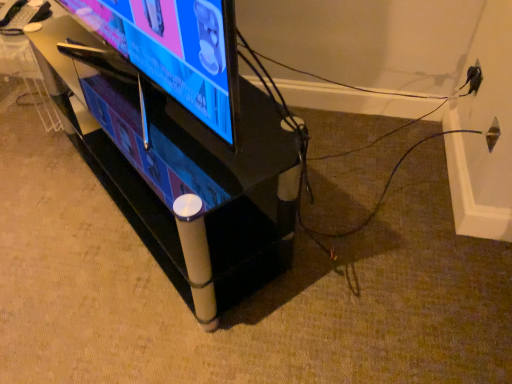
Question: Does black glossy tv stand at center have a larger size compared to matte black tv at center?

Choices:
 (A) yes
 (B) no

Answer: (A)

Question: Is black glossy tv stand at center looking in the opposite direction of matte black tv at center?

Choices:
 (A) yes
 (B) no

Answer: (B)

Question: Is black glossy tv stand at center smaller than matte black tv at center?

Choices:
 (A) no
 (B) yes

Answer: (A)

Question: From the image's perspective, would you say black glossy tv stand at center is shown under matte black tv at center?

Choices:
 (A) yes
 (B) no

Answer: (A)

Question: Considering the relative sizes of black glossy tv stand at center and matte black tv at center in the image provided, is black glossy tv stand at center shorter than matte black tv at center?

Choices:
 (A) no
 (B) yes

Answer: (A)

Question: Considering the relative sizes of black glossy tv stand at center and matte black tv at center in the image provided, is black glossy tv stand at center taller than matte black tv at center?

Choices:
 (A) yes
 (B) no

Answer: (A)

Question: From a real-world perspective, is matte black tv at center physically below black glossy tv stand at center?

Choices:
 (A) yes
 (B) no

Answer: (B)

Question: Is matte black tv at center completely or partially outside of black glossy tv stand at center?

Choices:
 (A) no
 (B) yes

Answer: (B)

Question: Can you confirm if matte black tv at center is taller than black glossy tv stand at center?

Choices:
 (A) no
 (B) yes

Answer: (A)

Question: Is the depth of matte black tv at center greater than that of black glossy tv stand at center?

Choices:
 (A) no
 (B) yes

Answer: (A)

Question: Is black glossy tv stand at center located within matte black tv at center?

Choices:
 (A) no
 (B) yes

Answer: (A)

Question: From the image's perspective, is matte black tv at center on black glossy tv stand at center?

Choices:
 (A) no
 (B) yes

Answer: (B)

Question: Looking at the image, does black glossy tv stand at center seem bigger or smaller compared to matte black tv at center?

Choices:
 (A) big
 (B) small

Answer: (A)